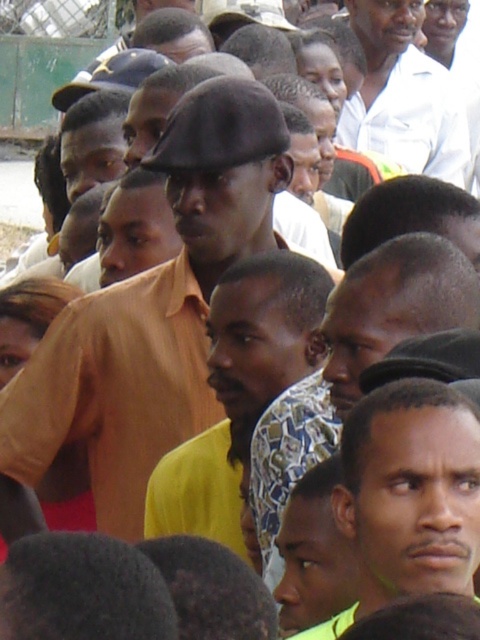
Is matte yellow shirt at center in front of white shirt at upper center?

Yes, it is.

Who is higher up, matte yellow shirt at center or white shirt at upper center?

white shirt at upper center is higher up.

Identify the location of matte yellow shirt at center. The image size is (480, 640). (240, 392).